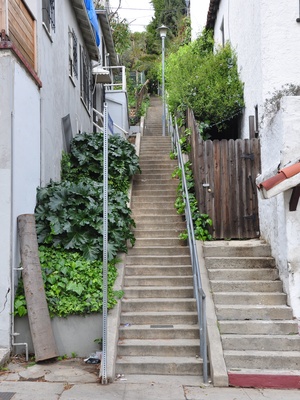
Identify the location of stairs on righthand stairway. This screenshot has height=400, width=300. (268, 379), (264, 361), (262, 343), (258, 327), (251, 312), (247, 297), (244, 286), (243, 275), (241, 263), (239, 250).